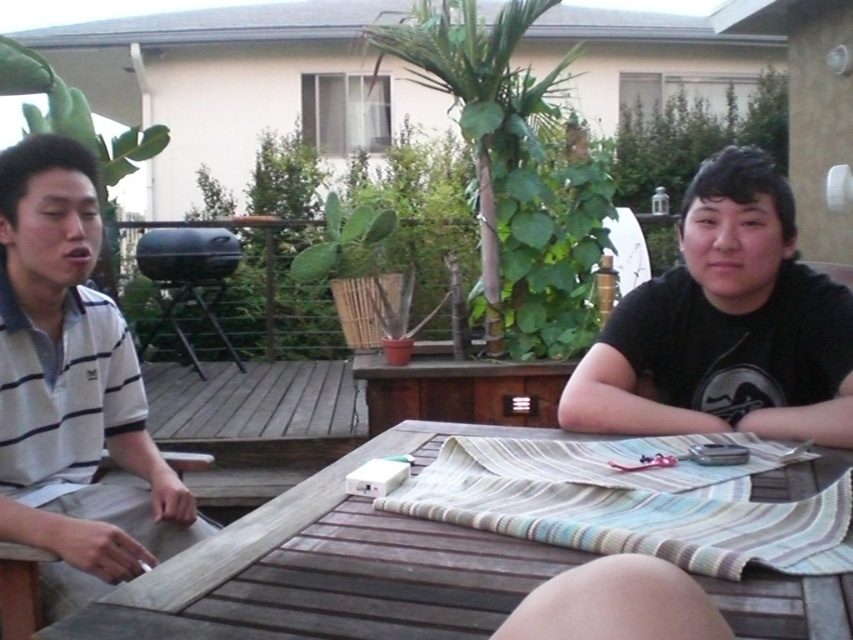
Does wooden table at center have a smaller size compared to white striped polo shirt at left?

Yes.

Is wooden table at center to the left of white striped polo shirt at left from the viewer's perspective?

In fact, wooden table at center is to the right of white striped polo shirt at left.

What do you see at coordinates (335, 566) in the screenshot? I see `wooden table at center` at bounding box center [335, 566].

Find the location of a particular element. wooden table at center is located at coordinates (335, 566).

Between point (54, 241) and point (819, 314), which one is positioned behind?

The point (819, 314) is more distant.

Is white striped polo shirt at left above black matte shirt at right?

Actually, white striped polo shirt at left is below black matte shirt at right.

Locate an element on the screen. This screenshot has height=640, width=853. white striped polo shirt at left is located at coordinates (73, 390).

Where is `white striped polo shirt at left`? white striped polo shirt at left is located at coordinates (73, 390).

Does wooden table at center have a greater height compared to black matte shirt at right?

No, wooden table at center is not taller than black matte shirt at right.

Can you confirm if wooden table at center is thinner than black matte shirt at right?

In fact, wooden table at center might be wider than black matte shirt at right.

The image size is (853, 640). Identify the location of wooden table at center. (335, 566).